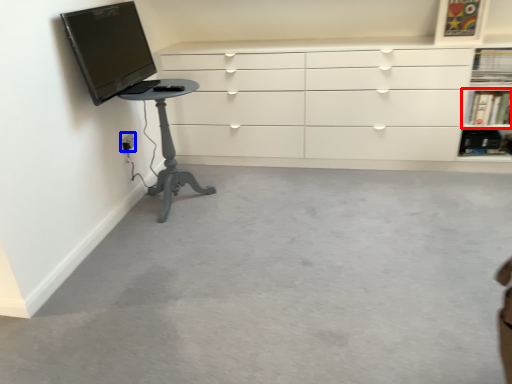
Question: Among these objects, which one is farthest to the camera, shelf (highlighted by a red box) or electric outlet (highlighted by a blue box)?

Choices:
 (A) shelf
 (B) electric outlet

Answer: (A)